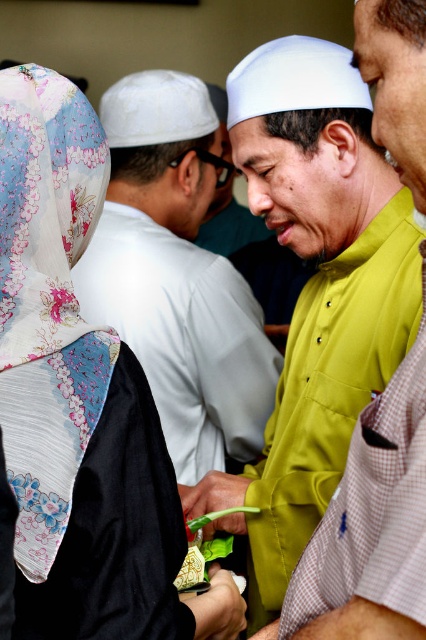
Question: Which object is the farthest from the floral-patterned fabric headscarf at upper left?

Choices:
 (A) green matte shirt at center
 (B) matte yellow shirt at center
 (C) black satin robe at lower left
 (D) floral silk hijab at upper left

Answer: (B)

Question: Observing the image, what is the correct spatial positioning of floral-patterned fabric headscarf at upper left in reference to black satin robe at lower left?

Choices:
 (A) right
 (B) left

Answer: (A)

Question: Which point is farther from the camera taking this photo?

Choices:
 (A) (241, 342)
 (B) (60, 401)

Answer: (A)

Question: Can you confirm if floral silk hijab at upper left is positioned to the left of black satin robe at lower left?

Choices:
 (A) yes
 (B) no

Answer: (A)

Question: From the image, what is the correct spatial relationship of green matte shirt at center in relation to floral silk hijab at upper left?

Choices:
 (A) below
 (B) above

Answer: (A)

Question: Among these objects, which one is farthest from the camera?

Choices:
 (A) green matte shirt at center
 (B) matte yellow shirt at center
 (C) floral silk hijab at upper left
 (D) floral-patterned fabric headscarf at upper left

Answer: (B)